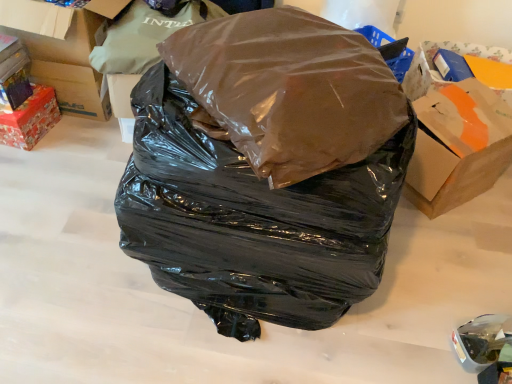
Where is `free spot to the right of brown matte plastic bag at center, placed as the 1th plastic bag when sorted from bottom to top`? The image size is (512, 384). free spot to the right of brown matte plastic bag at center, placed as the 1th plastic bag when sorted from bottom to top is located at coordinates (431, 284).